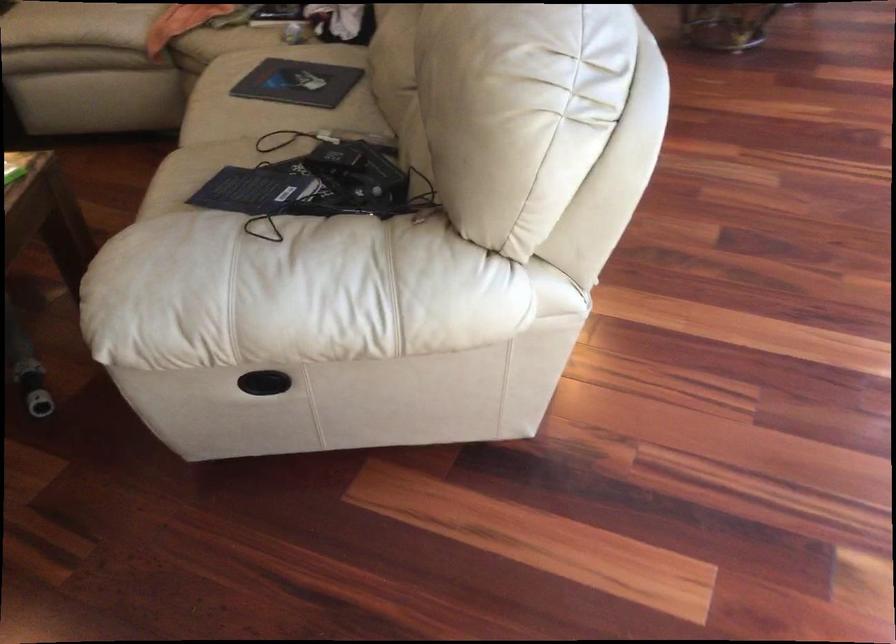
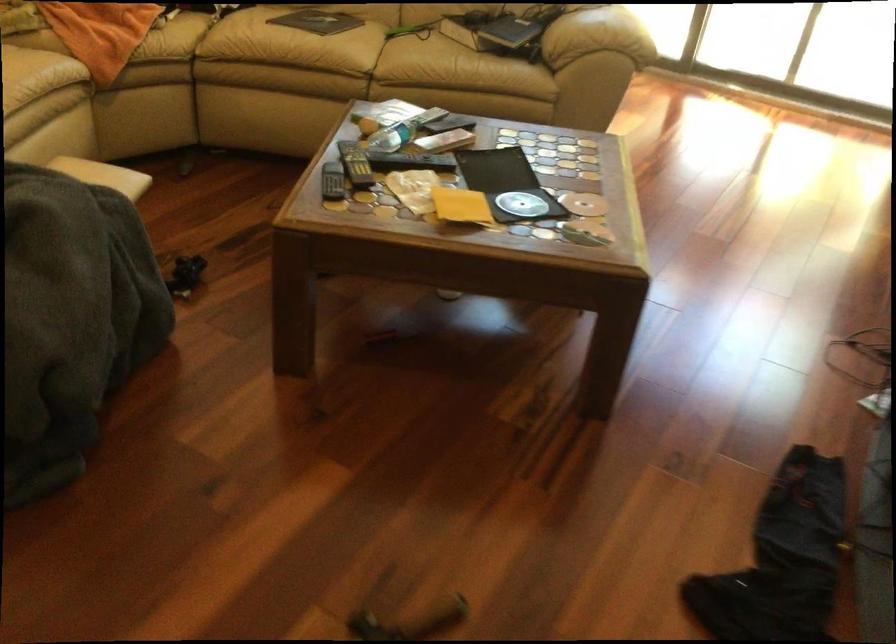
Where in the second image is the point corresponding to the point at 125,243 from the first image?

(597, 35)